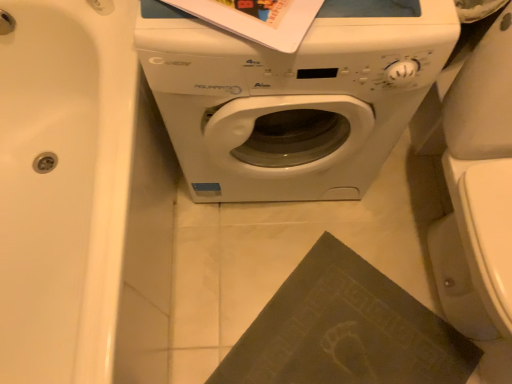
Question: Can you confirm if dark matte book at lower right is smaller than white glossy bathtub at left?

Choices:
 (A) no
 (B) yes

Answer: (B)

Question: Are dark matte book at lower right and white glossy bathtub at left beside each other?

Choices:
 (A) yes
 (B) no

Answer: (B)

Question: From a real-world perspective, is dark matte book at lower right on top of white glossy bathtub at left?

Choices:
 (A) yes
 (B) no

Answer: (B)

Question: Does dark matte book at lower right appear on the right side of white glossy bathtub at left?

Choices:
 (A) no
 (B) yes

Answer: (B)

Question: Considering the relative sizes of dark matte book at lower right and white glossy bathtub at left in the image provided, is dark matte book at lower right taller than white glossy bathtub at left?

Choices:
 (A) yes
 (B) no

Answer: (B)

Question: In the image, is white glossy washing machine at center positioned in front of or behind dark matte book at lower right?

Choices:
 (A) behind
 (B) front

Answer: (B)

Question: From the image's perspective, is white glossy washing machine at center positioned above or below dark matte book at lower right?

Choices:
 (A) below
 (B) above

Answer: (B)

Question: Considering the positions of white glossy washing machine at center and dark matte book at lower right in the image, is white glossy washing machine at center wider or thinner than dark matte book at lower right?

Choices:
 (A) wide
 (B) thin

Answer: (A)

Question: From a real-world perspective, relative to dark matte book at lower right, is white glossy washing machine at center vertically above or below?

Choices:
 (A) below
 (B) above

Answer: (B)

Question: Would you say dark matte book at lower right is to the left or to the right of white glossy washing machine at center in the picture?

Choices:
 (A) left
 (B) right

Answer: (B)

Question: From the image's perspective, is dark matte book at lower right above or below white glossy washing machine at center?

Choices:
 (A) below
 (B) above

Answer: (A)

Question: Is dark matte book at lower right wider or thinner than white glossy washing machine at center?

Choices:
 (A) thin
 (B) wide

Answer: (A)

Question: In terms of size, does dark matte book at lower right appear bigger or smaller than white glossy washing machine at center?

Choices:
 (A) small
 (B) big

Answer: (A)

Question: Would you say white glossy washing machine at center is inside or outside white glossy bathtub at left?

Choices:
 (A) outside
 (B) inside

Answer: (A)

Question: Is white glossy washing machine at center taller or shorter than white glossy bathtub at left?

Choices:
 (A) tall
 (B) short

Answer: (A)